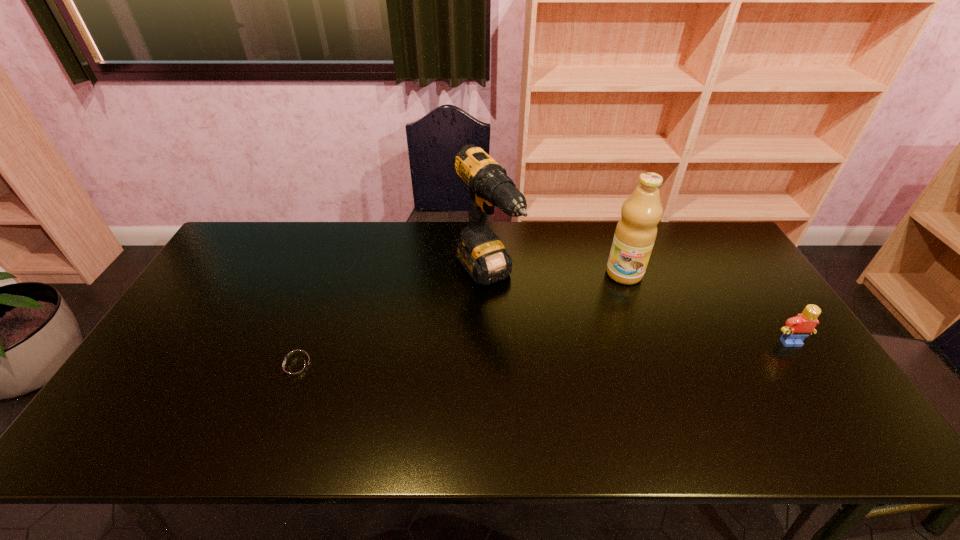
The height and width of the screenshot is (540, 960). Identify the location of free space at the far edge of the desktop. (453, 256).

I want to click on vacant area at the near edge, so click(494, 406).

The width and height of the screenshot is (960, 540). Identify the location of vacant space at the left edge of the desktop. (247, 296).

Find the location of `vacant space at the right edge`. vacant space at the right edge is located at coordinates (710, 291).

In the image, there is a desktop. Where is `vacant space at the far left corner`? vacant space at the far left corner is located at coordinates (248, 234).

Where is `vacant area that lies between the third object from left to right and the drill`? The width and height of the screenshot is (960, 540). vacant area that lies between the third object from left to right and the drill is located at coordinates (555, 274).

You are a GUI agent. You are given a task and a screenshot of the screen. Output one action in this format:
    pyautogui.click(x=<x>, y=<y>)
    Task: Click on the vacant area that lies between the Lego and the olive oil
    Image resolution: width=960 pixels, height=540 pixels.
    Given the screenshot: What is the action you would take?
    pyautogui.click(x=708, y=308)

This screenshot has height=540, width=960. I want to click on vacant area between the second object from right to left and the rightmost object, so click(x=708, y=308).

Locate an element on the screen. The image size is (960, 540). unoccupied area between the second object from left to right and the leftmost object is located at coordinates (391, 321).

Locate an element on the screen. free area in between the rightmost object and the second object from left to right is located at coordinates (638, 308).